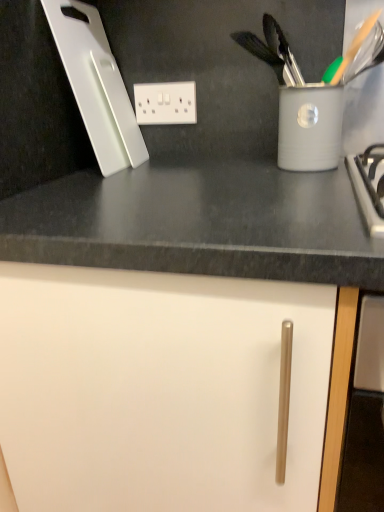
Where is `free space above white matte cabinet door at center (from a real-world perspective)`? The height and width of the screenshot is (512, 384). free space above white matte cabinet door at center (from a real-world perspective) is located at coordinates (214, 175).